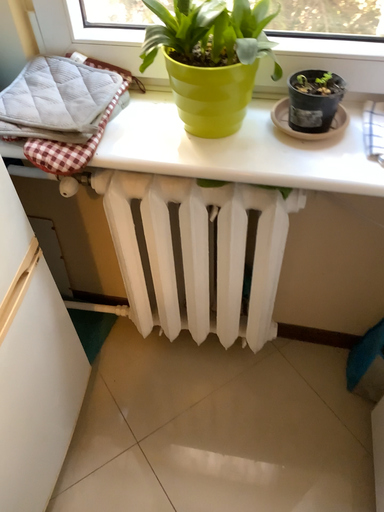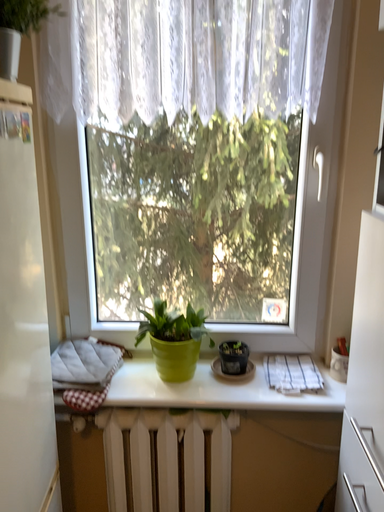
Question: Which way did the camera rotate in the video?

Choices:
 (A) rotated right
 (B) rotated left

Answer: (A)